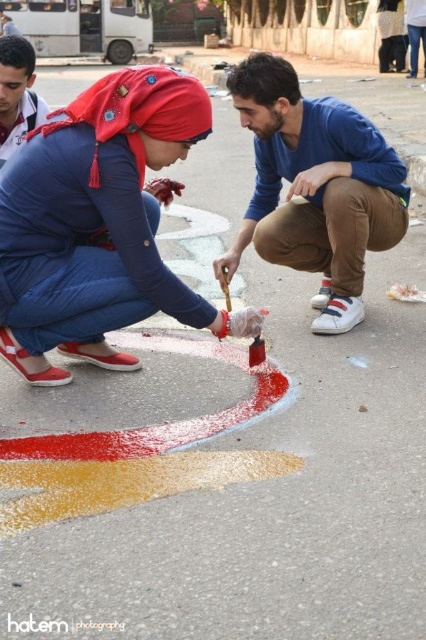
Which is below, blue cotton shirt at center or smooth blue shirt at upper left?

blue cotton shirt at center

Is point (317, 225) behind point (20, 86)?

No, it is not.

Find the location of `blue cotton shirt at center`. blue cotton shirt at center is located at coordinates (314, 188).

Is blue cotton shirt at center behind wooden handle paint brush at center?

No, blue cotton shirt at center is in front of wooden handle paint brush at center.

How far apart are blue cotton shirt at center and wooden handle paint brush at center?

blue cotton shirt at center is 57.41 centimeters away from wooden handle paint brush at center.

Locate an element on the screen. The width and height of the screenshot is (426, 640). blue cotton shirt at center is located at coordinates (314, 188).

Is matte red paintbrush at center above smooth blue shirt at upper left?

No.

Looking at this image, is matte red paintbrush at center thinner than smooth blue shirt at upper left?

No, matte red paintbrush at center is not thinner than smooth blue shirt at upper left.

This screenshot has height=640, width=426. Describe the element at coordinates (97, 224) in the screenshot. I see `matte red paintbrush at center` at that location.

Where is `matte red paintbrush at center`? This screenshot has height=640, width=426. matte red paintbrush at center is located at coordinates (97, 224).